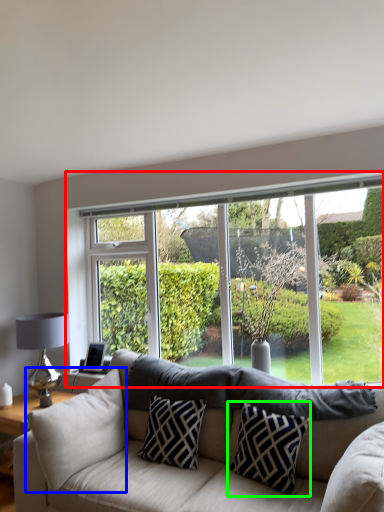
Question: Based on their relative distances, which object is farther from window (highlighted by a red box)? Choose from pillow (highlighted by a blue box) and pillow (highlighted by a green box).

Choices:
 (A) pillow
 (B) pillow

Answer: (A)